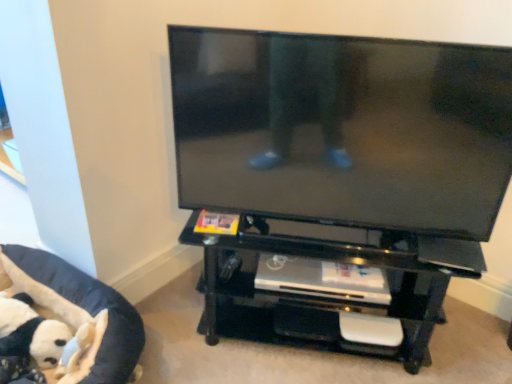
Where is `free space below black glossy flat-screen tv at center (from a real-world perspective)`? The height and width of the screenshot is (384, 512). free space below black glossy flat-screen tv at center (from a real-world perspective) is located at coordinates tap(362, 232).